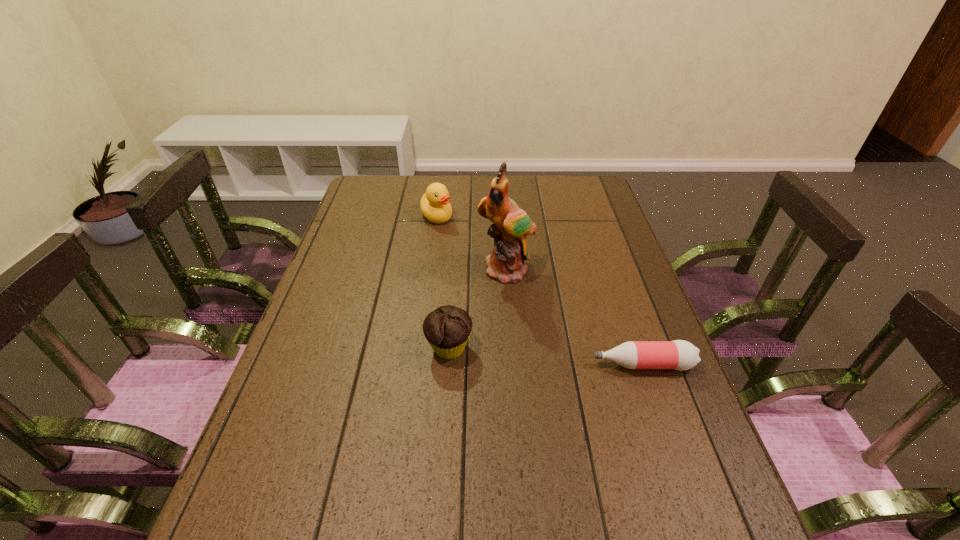
Where is `free point at the near edge`? free point at the near edge is located at coordinates (528, 480).

Locate an element on the screen. free space at the left edge of the desktop is located at coordinates (382, 232).

In the image, there is a desktop. Where is `vacant space at the right edge`? This screenshot has height=540, width=960. vacant space at the right edge is located at coordinates (588, 293).

What are the coordinates of `unoccupied area between the second object from right to left and the bottle` in the screenshot? It's located at (574, 318).

I want to click on free area in between the second object from right to left and the farthest object, so click(x=471, y=244).

At what (x,y) coordinates should I click in order to perform the action: click on vacant point located between the parrot and the muffin. Please return your answer as a coordinate pair (x, y). Looking at the image, I should click on (478, 309).

Find the location of a particular element. This screenshot has width=960, height=540. unoccupied position between the muffin and the tallest object is located at coordinates (478, 309).

What are the coordinates of `free space between the muffin and the second tallest object` in the screenshot? It's located at (443, 282).

Locate an element on the screen. The height and width of the screenshot is (540, 960). free space between the duck and the second farthest object is located at coordinates (471, 244).

Locate an element on the screen. The height and width of the screenshot is (540, 960). free point between the shortest object and the duck is located at coordinates (540, 291).